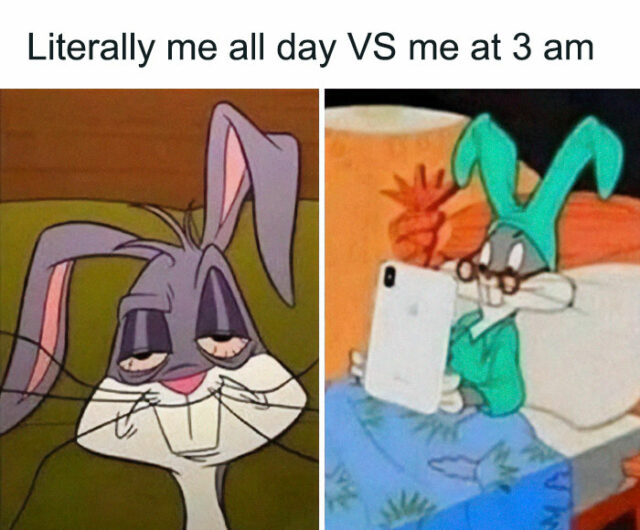
You are a GUI agent. You are given a task and a screenshot of the screen. Output one action in this format:
    pyautogui.click(x=<x>, y=<y>)
    Task: Click on the bed
    Image resolution: width=640 pixels, height=530 pixels.
    Given the screenshot: What is the action you would take?
    pyautogui.click(x=562, y=435)